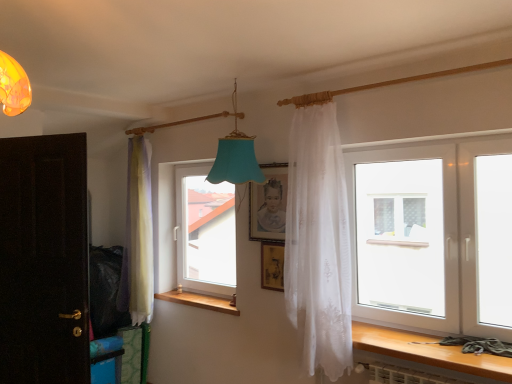
Image resolution: width=512 pixels, height=384 pixels. Identify the location of white sheer curtain at center, the first curtain when ordered from front to back. (318, 237).

What are the coordinates of `wooden table at lower right` in the screenshot? It's located at click(428, 351).

At what (x,y) coordinates should I click in order to perform the action: click on transparent plastic window at right, positioned as the second window in back-to-front order. Please return your answer as a coordinate pair (x, y). This screenshot has width=512, height=384. Looking at the image, I should click on (434, 236).

The image size is (512, 384). In order to click on wooden at left in this screenshot , I will do `click(199, 301)`.

At what (x,y) coordinates should I click in order to perform the action: click on white sheer curtain at center, the first curtain when ordered from front to back. Please return your answer as a coordinate pair (x, y). The width and height of the screenshot is (512, 384). Looking at the image, I should click on (318, 237).

I want to click on the 2nd window to the right of the pastel sheer curtains at left, which is the first curtain in left-to-right order, counting from the anchor's position, so click(x=434, y=236).

From the image's perspective, is pastel sheer curtains at left, the 2th curtain positioned from the right, above or below transparent plastic window at right, the 1th window positioned from the front?

pastel sheer curtains at left, the 2th curtain positioned from the right, is below transparent plastic window at right, the 1th window positioned from the front.

Does point (142, 136) lie behind point (379, 283)?

That is True.

Is pastel sheer curtains at left, which is the first curtain in left-to-right order, closer to camera compared to transparent plastic window at right, the 1th window positioned from the front?

Answer: No, it is behind transparent plastic window at right, the 1th window positioned from the front.

You are a GUI agent. You are given a task and a screenshot of the screen. Output one action in this format:
    pyautogui.click(x=<x>, y=<y>)
    Task: Click on the curtain on the right of pastel sheer curtains at left, the 2th curtain positioned from the right
    This screenshot has width=512, height=384.
    Given the screenshot: What is the action you would take?
    pyautogui.click(x=318, y=237)

From a real-world perspective, relative to pastel sheer curtains at left, the 2th curtain positioned from the right, is white sheer curtain at center, the first curtain when ordered from front to back, vertically above or below?

white sheer curtain at center, the first curtain when ordered from front to back, is situated higher than pastel sheer curtains at left, the 2th curtain positioned from the right, in the real world.

Considering the relative sizes of white sheer curtain at center, the first curtain when ordered from front to back, and pastel sheer curtains at left, the second curtain from the front, in the image provided, is white sheer curtain at center, the first curtain when ordered from front to back, taller than pastel sheer curtains at left, the second curtain from the front,?

Yes.

Is transparent plastic window at right, placed as the first window when sorted from right to left, located within wooden frame at center, which ranks as the 1th picture frame in bottom-to-top order?

No, transparent plastic window at right, placed as the first window when sorted from right to left, is not a part of wooden frame at center, which ranks as the 1th picture frame in bottom-to-top order.

Which is nearer, (269, 276) or (442, 289)?

The point (442, 289) is closer.

Would you say wooden frame at center, positioned as the second picture frame in top-to-bottom order, is to the left or to the right of transparent plastic window at right, positioned as the second window in back-to-front order, in the picture?

From the image, it's evident that wooden frame at center, positioned as the second picture frame in top-to-bottom order, is to the left of transparent plastic window at right, positioned as the second window in back-to-front order.

Which of these two, wooden frame at center, positioned as the second picture frame in top-to-bottom order, or transparent plastic window at right, positioned as the second window in back-to-front order, stands taller?

transparent plastic window at right, positioned as the second window in back-to-front order, is taller.

Where is `the 2nd curtain located beneath the matte wooden picture frame at center, the second picture frame positioned from the bottom (from a real-world perspective)`? This screenshot has width=512, height=384. the 2nd curtain located beneath the matte wooden picture frame at center, the second picture frame positioned from the bottom (from a real-world perspective) is located at coordinates (139, 232).

Between pastel sheer curtains at left, the 2th curtain positioned from the right, and matte wooden picture frame at center, the second picture frame positioned from the bottom, which one has less height?

matte wooden picture frame at center, the second picture frame positioned from the bottom, is shorter.

Can we say pastel sheer curtains at left, which is the first curtain in left-to-right order, lies outside matte wooden picture frame at center, the 1th picture frame from the top?

That's correct, pastel sheer curtains at left, which is the first curtain in left-to-right order, is outside of matte wooden picture frame at center, the 1th picture frame from the top.

What's the angular difference between pastel sheer curtains at left, the 2th curtain positioned from the right, and matte wooden picture frame at center, the second picture frame positioned from the bottom,'s facing directions?

0.000838 degrees.

Is white sheer curtain at center, which ranks as the 2th curtain in left-to-right order, at the back of matte wooden picture frame at center, the 1th picture frame from the top?

No, matte wooden picture frame at center, the 1th picture frame from the top, is not facing away from white sheer curtain at center, which ranks as the 2th curtain in left-to-right order.

Is there a large distance between matte wooden picture frame at center, the second picture frame positioned from the bottom, and white sheer curtain at center, acting as the 1th curtain starting from the right?

No, matte wooden picture frame at center, the second picture frame positioned from the bottom, is not far from white sheer curtain at center, acting as the 1th curtain starting from the right.

Does matte wooden picture frame at center, the 1th picture frame from the top, have a greater height compared to white sheer curtain at center, which ranks as the 2th curtain in left-to-right order?

No.

Is white sheer curtain at center, which ranks as the 2th curtain in left-to-right order, spatially inside transparent plastic window at right, the 1th window positioned from the front, or outside of it?

white sheer curtain at center, which ranks as the 2th curtain in left-to-right order, is not inside transparent plastic window at right, the 1th window positioned from the front, it's outside.

Looking at this image, would you say white sheer curtain at center, the 2th curtain from the back, is a long distance from transparent plastic window at right, placed as the first window when sorted from right to left?

white sheer curtain at center, the 2th curtain from the back, is actually quite close to transparent plastic window at right, placed as the first window when sorted from right to left.

From a real-world perspective, is white sheer curtain at center, the 2th curtain from the back, over transparent plastic window at right, positioned as the second window in back-to-front order?

Indeed, from a real-world perspective, white sheer curtain at center, the 2th curtain from the back, stands above transparent plastic window at right, positioned as the second window in back-to-front order.

What's the angular difference between matte wooden picture frame at center, the second picture frame positioned from the bottom, and wooden at left's facing directions?

matte wooden picture frame at center, the second picture frame positioned from the bottom, and wooden at left are facing 0.000889 degrees away from each other.

Considering the points (278, 171) and (177, 290), which point is in front, point (278, 171) or point (177, 290)?

The point (278, 171) is in front.

Is wooden at left located within matte wooden picture frame at center, the second picture frame positioned from the bottom?

No, wooden at left is not a part of matte wooden picture frame at center, the second picture frame positioned from the bottom.

Find the location of `window located above the pastel sheer curtains at left, which is the first curtain in left-to-right order (from a real-world perspective)`. window located above the pastel sheer curtains at left, which is the first curtain in left-to-right order (from a real-world perspective) is located at coordinates (434, 236).

The image size is (512, 384). What are the coordinates of `curtain that is on the right side of pastel sheer curtains at left, the 2th curtain positioned from the right` in the screenshot? It's located at (318, 237).

When comparing their distances from pastel sheer curtains at left, which is the first curtain in left-to-right order, does wooden frame at center, positioned as the second picture frame in top-to-bottom order, or wooden table at lower right seem closer?

wooden frame at center, positioned as the second picture frame in top-to-bottom order, lies closer to pastel sheer curtains at left, which is the first curtain in left-to-right order, than the other object.

When comparing their distances from wooden at left, does transparent glass window at center, which is counted as the second window, starting from the right, or dark wood door at left seem further?

Based on the image, dark wood door at left appears to be further to wooden at left.

Estimate the real-world distances between objects in this image. Which object is closer to transparent glass window at center, which is the 1th window in back-to-front order, pastel sheer curtains at left, the second curtain from the front, or white sheer curtain at center, the first curtain when ordered from front to back?

pastel sheer curtains at left, the second curtain from the front, is positioned closer to the anchor transparent glass window at center, which is the 1th window in back-to-front order.

Which object lies nearer to the anchor point transparent glass window at center, which is the 1th window from left to right, matte wooden picture frame at center, the second picture frame positioned from the bottom, or wooden table at lower right?

The object closer to transparent glass window at center, which is the 1th window from left to right, is matte wooden picture frame at center, the second picture frame positioned from the bottom.

Considering their positions, is wooden frame at center, positioned as the second picture frame in top-to-bottom order, positioned further to transparent glass window at center, which is the 1th window from left to right, than wooden at left?

wooden frame at center, positioned as the second picture frame in top-to-bottom order.

Looking at the image, which one is located further to matte wooden picture frame at center, the 1th picture frame from the top, transparent plastic window at right, positioned as the second window in back-to-front order, or dark wood door at left?

Based on the image, dark wood door at left appears to be further to matte wooden picture frame at center, the 1th picture frame from the top.

Estimate the real-world distances between objects in this image. Which object is closer to wooden frame at center, positioned as the second picture frame in top-to-bottom order, wooden at left or dark wood door at left?

wooden at left is closer to wooden frame at center, positioned as the second picture frame in top-to-bottom order.

From the image, which object appears to be farther from matte wooden picture frame at center, the 1th picture frame from the top, pastel sheer curtains at left, which is the first curtain in back-to-front order, or wooden table at lower right?

pastel sheer curtains at left, which is the first curtain in back-to-front order, is further to matte wooden picture frame at center, the 1th picture frame from the top.

Image resolution: width=512 pixels, height=384 pixels. I want to click on curtain between wooden at left and wooden table at lower right, so click(318, 237).

Identify the location of window between pastel sheer curtains at left, which is the first curtain in left-to-right order, and wooden at left in the up-down direction. (205, 232).

You are a GUI agent. You are given a task and a screenshot of the screen. Output one action in this format:
    pyautogui.click(x=<x>, y=<y>)
    Task: Click on the curtain between dark wood door at left and wooden frame at center, positioned as the second picture frame in top-to-bottom order, from left to right
    This screenshot has width=512, height=384.
    Given the screenshot: What is the action you would take?
    pyautogui.click(x=139, y=232)

At what (x,y) coordinates should I click in order to perform the action: click on picture frame between wooden table at lower right and wooden frame at center, positioned as the second picture frame in top-to-bottom order, in the front-back direction. Please return your answer as a coordinate pair (x, y). Looking at the image, I should click on point(269,204).